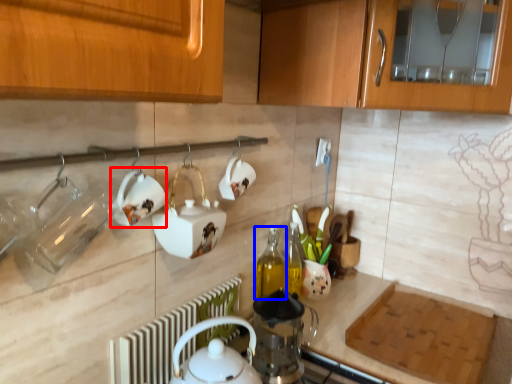
Question: Which point is further to the camera, tableware (highlighted by a red box) or bottle (highlighted by a blue box)?

Choices:
 (A) tableware
 (B) bottle

Answer: (B)